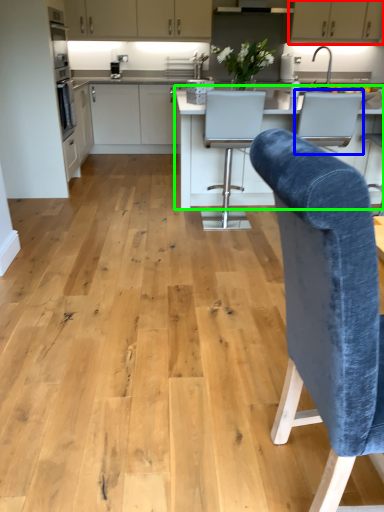
Question: Estimate the real-world distances between objects in this image. Which object is farther from cabinetry (highlighted by a red box), armchair (highlighted by a blue box) or countertop (highlighted by a green box)?

Choices:
 (A) armchair
 (B) countertop

Answer: (A)